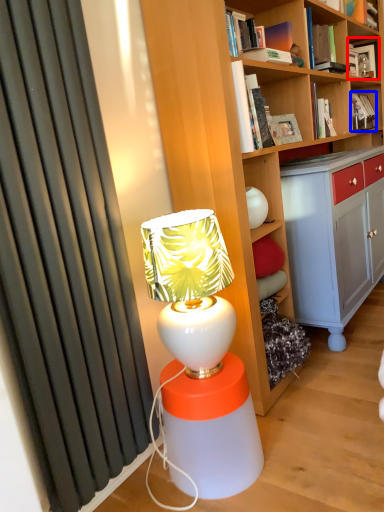
Question: Among these objects, which one is farthest to the camera, book (highlighted by a red box) or book (highlighted by a blue box)?

Choices:
 (A) book
 (B) book

Answer: (A)